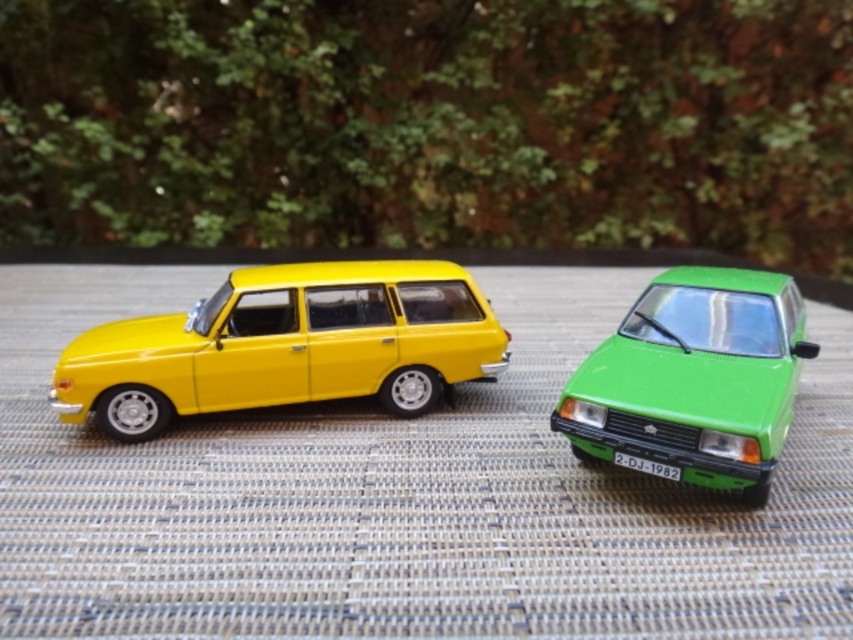
You are a delivery person trying to determine which car has more space in the trunk. Based on the image, which car between the matte yellow station wagon at center and the green matte car at center would you choose for carrying large items?

The matte yellow station wagon at center has a lesser height compared to the green matte car at center, so the green matte car at center likely has more trunk space due to its greater height.

You are a toy organizer who needs to place both cars in a display case that is 18 inches wide. Can both the matte yellow station wagon at center and the green matte car at center fit side by side without overlapping?

The matte yellow station wagon at center is 17.60 inches away from the green matte car at center, so yes, both cars can fit side by side in the 18 inch wide display case since the total required space is less than 18 inches.

You are a delivery person who needs to park your van between the two cars in the image. The van is 1.8 meters wide. Can you fit your van between the matte yellow station wagon at center and the green matte car at center if the space between them is exactly the average of their widths?

The matte yellow station wagon at center is wider than the green matte car at center. To determine if the van can fit, calculate the average of their widths. Since the space between them is set to this average, and the van is 1.8 meters wide, the van can fit only if the average width is at least 1.8 meters. However, without knowing the exact widths, we cannot confirm. But since the yellow car is wider, the average would be larger than the green car alone. If the green car is narrower than 1.8m, the average